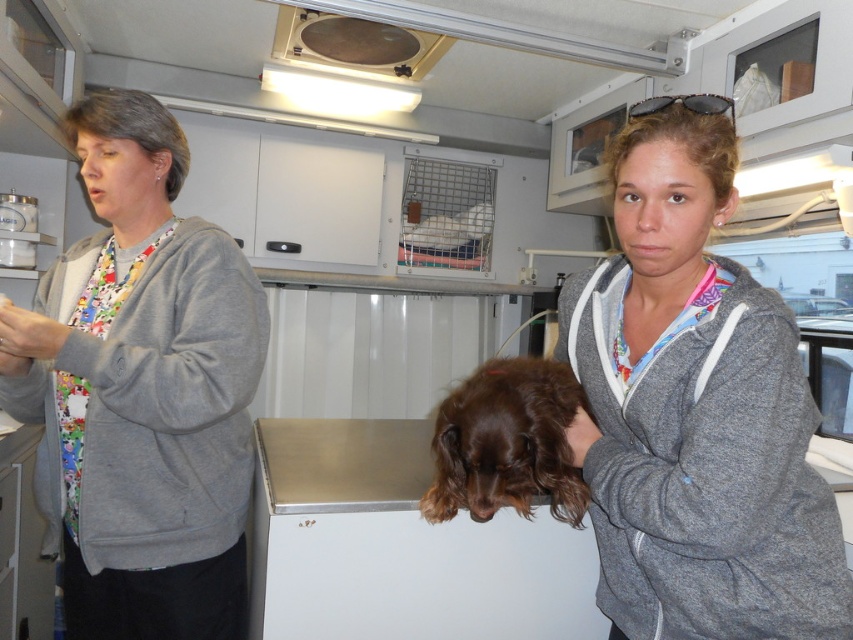
Based on the scene description, where is the brown furry dog at center located in terms of coordinates?

The brown furry dog at center is located at coordinates point (508, 442).

You are a veterinary assistant who needs to place a protective cover over the brown furry dog at center and the matte black goggles at upper center. Which object requires a larger cover based on their widths?

The brown furry dog at center requires a larger cover because it is wider than the matte black goggles at upper center according to the description.